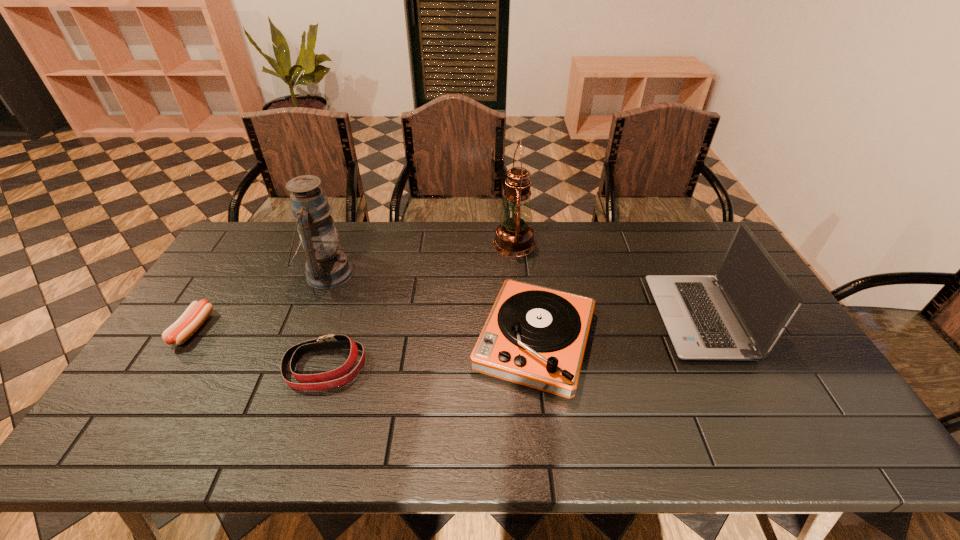
The image size is (960, 540). I want to click on vacant space located on the screen of the fourth shortest object, so click(x=621, y=318).

Image resolution: width=960 pixels, height=540 pixels. What are the coordinates of `vacant space situated 0.120m on the screen of the fourth shortest object` in the screenshot? It's located at (618, 318).

What are the coordinates of `vacant region located on the screen of the fourth shortest object` in the screenshot? It's located at (584, 318).

Find the location of `free location located 0.350m on the left of the record player`. free location located 0.350m on the left of the record player is located at coordinates (345, 340).

The image size is (960, 540). Identify the location of free spot located on the front of the dog collar. (301, 442).

Locate an element on the screen. This screenshot has height=540, width=960. blank space located 0.100m on the right of the leftmost object is located at coordinates (243, 329).

Find the location of `object that is at the left edge`. object that is at the left edge is located at coordinates (195, 315).

Where is `object at the right edge`? object at the right edge is located at coordinates (740, 313).

In order to click on vacant space at the far edge in this screenshot , I will do `click(354, 221)`.

You are a GUI agent. You are given a task and a screenshot of the screen. Output one action in this format:
    pyautogui.click(x=<x>, y=<y>)
    Task: Click on the vacant space at the near edge
    The image size is (960, 540).
    Given the screenshot: What is the action you would take?
    pyautogui.click(x=242, y=430)